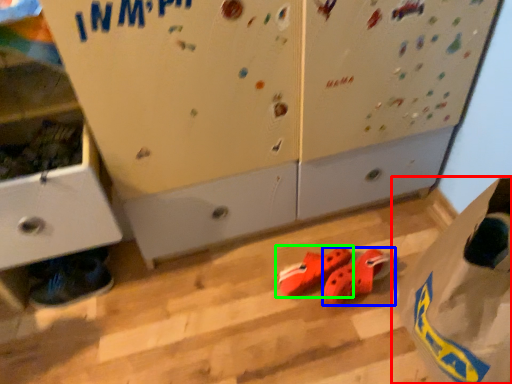
Question: Which is nearer to the paper bag (highlighted by a red box)? footwear (highlighted by a blue box) or footwear (highlighted by a green box).

Choices:
 (A) footwear
 (B) footwear

Answer: (A)